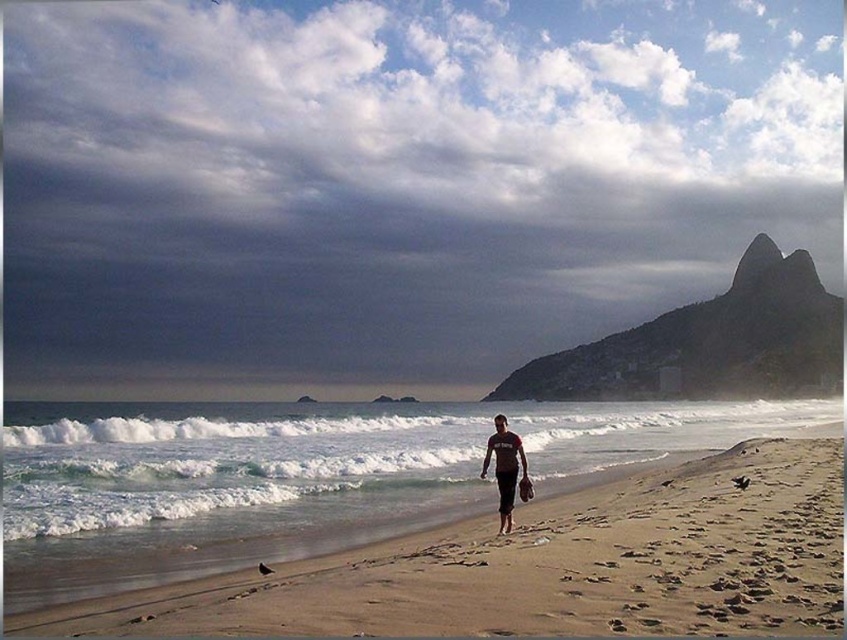
Does point (485, 452) come in front of point (530, 497)?

No, (485, 452) is behind (530, 497).

Describe the element at coordinates (504, 467) in the screenshot. This screenshot has width=847, height=640. I see `matte black shorts at center` at that location.

At what (x,y) coordinates should I click in order to perform the action: click on matte black shorts at center. Please return your answer as a coordinate pair (x, y). This screenshot has width=847, height=640. Looking at the image, I should click on (504, 467).

From the picture: Is white foamy wave at center taller than matte black shorts at center?

Yes, white foamy wave at center is taller than matte black shorts at center.

Can you confirm if white foamy wave at center is bigger than matte black shorts at center?

Yes.

Describe the element at coordinates (322, 458) in the screenshot. I see `white foamy wave at center` at that location.

Identify the location of white foamy wave at center. This screenshot has width=847, height=640. (322, 458).

Who is more distant from viewer, [712,410] or [519,488]?

Positioned behind is point [712,410].

Is white foamy wave at center below smooth brown surfboard at center?

Yes.

Which is in front, point (562, 458) or point (529, 484)?

Point (529, 484) is in front.

Locate an element on the screen. Image resolution: width=847 pixels, height=640 pixels. white foamy wave at center is located at coordinates (322, 458).